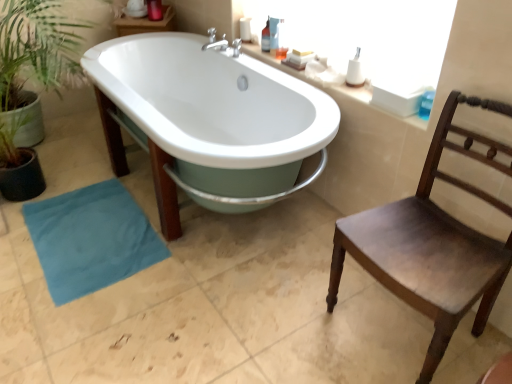
Where is `blank space situated above white glossy counter top at upper center (from a real-world perspective)`? The width and height of the screenshot is (512, 384). blank space situated above white glossy counter top at upper center (from a real-world perspective) is located at coordinates (295, 68).